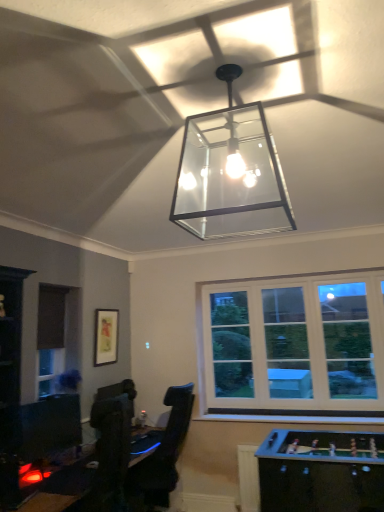
Question: Does black glossy table at lower left, which appears as the 2th table when viewed from the right, have a lesser height compared to matte black picture frame at upper left?

Choices:
 (A) yes
 (B) no

Answer: (A)

Question: From a real-world perspective, is black glossy table at lower left, the 1th table when ordered from left to right, over matte black picture frame at upper left?

Choices:
 (A) no
 (B) yes

Answer: (A)

Question: Does black glossy table at lower left, the 1th table when ordered from left to right, come behind matte black picture frame at upper left?

Choices:
 (A) no
 (B) yes

Answer: (A)

Question: Is black glossy table at lower left, the 1th table when ordered from left to right, positioned with its back to matte black picture frame at upper left?

Choices:
 (A) no
 (B) yes

Answer: (A)

Question: From the image's perspective, is black glossy table at lower left, which appears as the 2th table when viewed from the right, beneath matte black picture frame at upper left?

Choices:
 (A) yes
 (B) no

Answer: (A)

Question: From their relative heights in the image, would you say black glossy table at lower left, the 1th table when ordered from left to right, is taller or shorter than matte black picture frame at upper left?

Choices:
 (A) short
 (B) tall

Answer: (A)

Question: In the image, is black glossy table at lower left, the 1th table when ordered from left to right, on the left side or the right side of matte black picture frame at upper left?

Choices:
 (A) right
 (B) left

Answer: (A)

Question: Based on their sizes in the image, would you say black glossy table at lower left, which appears as the 2th table when viewed from the right, is bigger or smaller than matte black picture frame at upper left?

Choices:
 (A) big
 (B) small

Answer: (A)

Question: From the image's perspective, is black glossy table at lower left, which appears as the 2th table when viewed from the right, above or below matte black picture frame at upper left?

Choices:
 (A) above
 (B) below

Answer: (B)

Question: From the image's perspective, is black glossy table at lower left, which appears as the 2th table when viewed from the right, above or below wooden foosball table at lower right, which ranks as the 2th table in left-to-right order?

Choices:
 (A) below
 (B) above

Answer: (B)

Question: Based on their sizes in the image, would you say black glossy table at lower left, which appears as the 2th table when viewed from the right, is bigger or smaller than wooden foosball table at lower right, placed as the first table when sorted from right to left?

Choices:
 (A) small
 (B) big

Answer: (A)

Question: Relative to wooden foosball table at lower right, which ranks as the 2th table in left-to-right order, is black glossy table at lower left, the 1th table when ordered from left to right, in front or behind?

Choices:
 (A) behind
 (B) front

Answer: (B)

Question: Looking at their shapes, would you say black glossy table at lower left, the 1th table when ordered from left to right, is wider or thinner than wooden foosball table at lower right, which ranks as the 2th table in left-to-right order?

Choices:
 (A) thin
 (B) wide

Answer: (B)

Question: From their relative heights in the image, would you say matte black picture frame at upper left is taller or shorter than wooden foosball table at lower right, placed as the first table when sorted from right to left?

Choices:
 (A) tall
 (B) short

Answer: (B)

Question: Considering the positions of matte black picture frame at upper left and wooden foosball table at lower right, placed as the first table when sorted from right to left, in the image, is matte black picture frame at upper left bigger or smaller than wooden foosball table at lower right, placed as the first table when sorted from right to left,?

Choices:
 (A) small
 (B) big

Answer: (A)